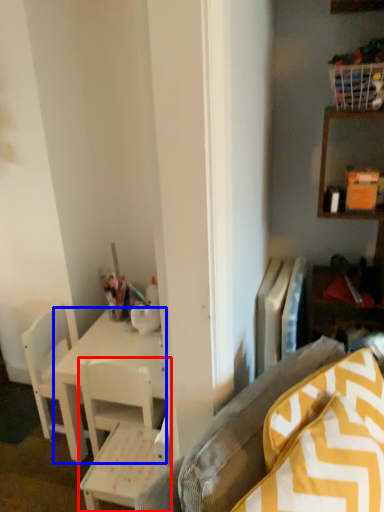
Question: Which point is closer to the camera, chair (highlighted by a red box) or desk (highlighted by a blue box)?

Choices:
 (A) chair
 (B) desk

Answer: (A)